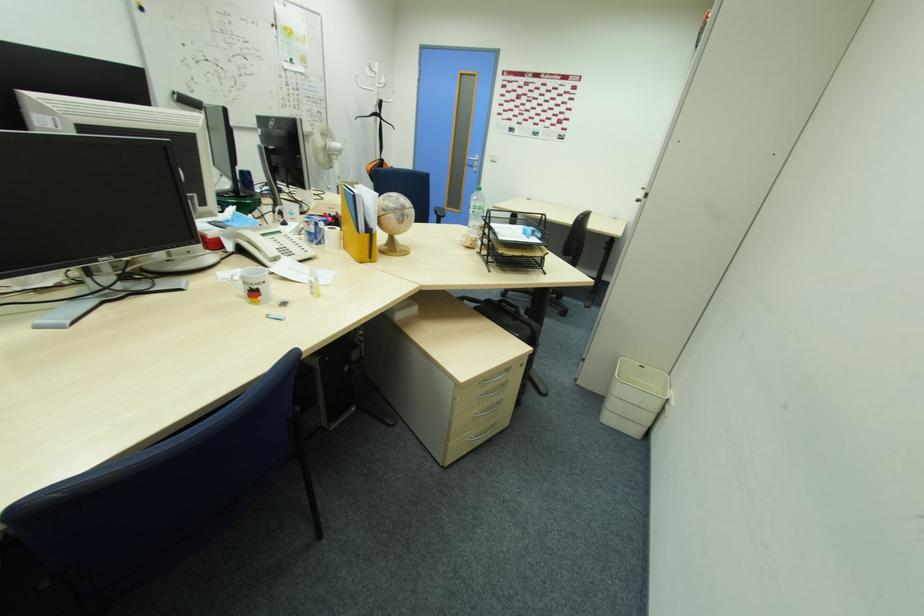
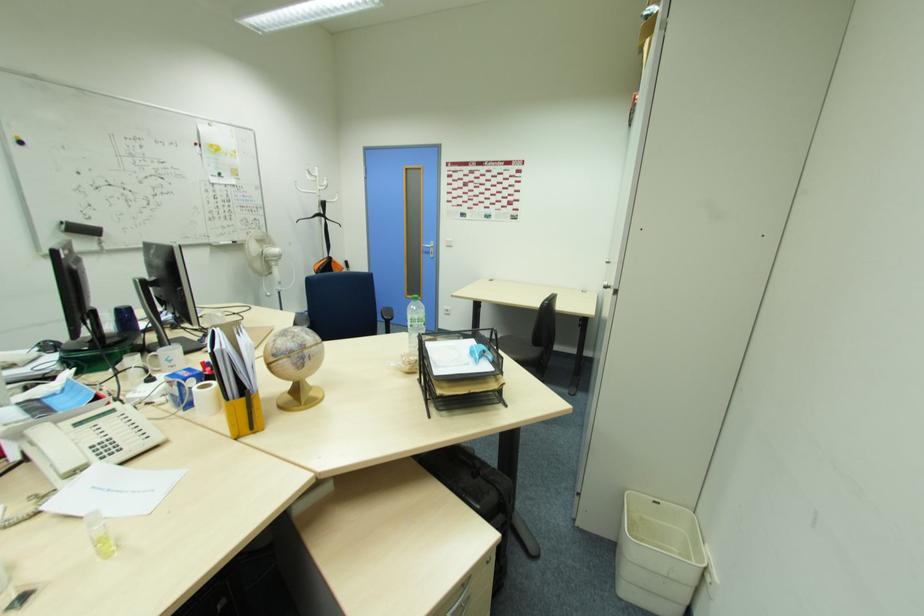
In the second image, find the point that corresponds to [528,233] in the first image.

(476, 354)